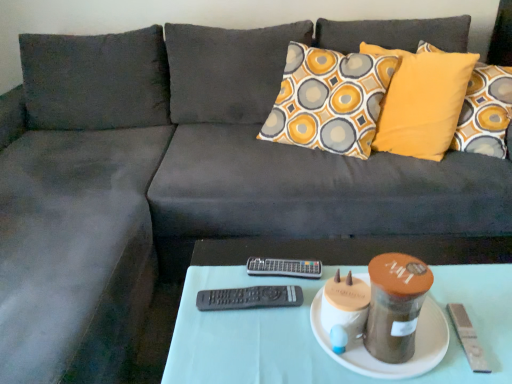
At what (x,y) coordinates should I click in order to perform the action: click on vacant position to the left of white ceramic plate at center. Please return your answer as a coordinate pair (x, y). This screenshot has width=512, height=384. Looking at the image, I should click on (253, 324).